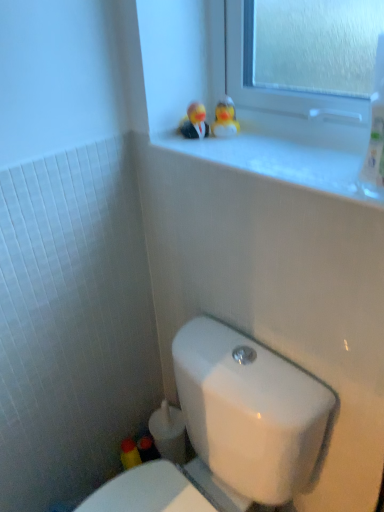
Question: In which direction should I rotate to look at rubber duckies at upper center, the 2th miniature when ordered from left to right?

Choices:
 (A) left
 (B) right

Answer: (B)

Question: Does rubber duckies at upper center, which is the first miniature in right-to-left order, have a greater width compared to white glossy window sill at upper center?

Choices:
 (A) no
 (B) yes

Answer: (A)

Question: Is rubber duckies at upper center, which is the first miniature in right-to-left order, to the right of white glossy window sill at upper center from the viewer's perspective?

Choices:
 (A) yes
 (B) no

Answer: (B)

Question: Can we say rubber duckies at upper center, which is the first miniature in right-to-left order, lies outside white glossy window sill at upper center?

Choices:
 (A) no
 (B) yes

Answer: (B)

Question: From the image's perspective, is rubber duckies at upper center, which is the first miniature in right-to-left order, over white glossy window sill at upper center?

Choices:
 (A) yes
 (B) no

Answer: (A)

Question: Can you confirm if rubber duckies at upper center, which is the first miniature in right-to-left order, is taller than white glossy window sill at upper center?

Choices:
 (A) yes
 (B) no

Answer: (A)

Question: Does rubber duckies at upper center, the 2th miniature when ordered from left to right, turn towards white glossy window sill at upper center?

Choices:
 (A) no
 (B) yes

Answer: (B)

Question: From the image's perspective, would you say rubber duck at upper center, placed as the 1th miniature when sorted from left to right, is positioned over rubber duckies at upper center, the 2th miniature when ordered from left to right?

Choices:
 (A) no
 (B) yes

Answer: (A)

Question: Is rubber duck at upper center, the second miniature from the right, at the right side of rubber duckies at upper center, which is the first miniature in right-to-left order?

Choices:
 (A) yes
 (B) no

Answer: (B)

Question: From a real-world perspective, is rubber duck at upper center, placed as the 1th miniature when sorted from left to right, physically above rubber duckies at upper center, which is the first miniature in right-to-left order?

Choices:
 (A) no
 (B) yes

Answer: (A)

Question: From a real-world perspective, is rubber duck at upper center, placed as the 1th miniature when sorted from left to right, physically below rubber duckies at upper center, the 2th miniature when ordered from left to right?

Choices:
 (A) yes
 (B) no

Answer: (A)

Question: Does rubber duck at upper center, the second miniature from the right, have a lesser height compared to rubber duckies at upper center, the 2th miniature when ordered from left to right?

Choices:
 (A) yes
 (B) no

Answer: (B)

Question: Does rubber duck at upper center, the second miniature from the right, come in front of rubber duckies at upper center, which is the first miniature in right-to-left order?

Choices:
 (A) no
 (B) yes

Answer: (B)

Question: From a real-world perspective, is white glossy window sill at upper center positioned under rubber duck at upper center, the second miniature from the right, based on gravity?

Choices:
 (A) yes
 (B) no

Answer: (A)